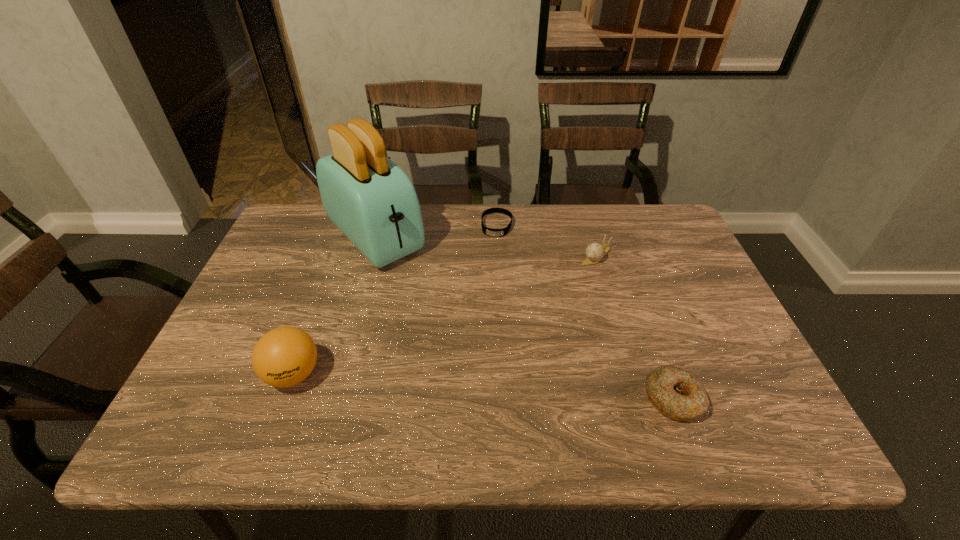
Locate an element on the screen. vacant space that's between the second tallest object and the tallest object is located at coordinates (334, 306).

The width and height of the screenshot is (960, 540). Identify the location of vacant point located between the escargot and the ping-pong ball. (444, 315).

Image resolution: width=960 pixels, height=540 pixels. Identify the location of object that stands as the closest to the wristband. (372, 201).

The height and width of the screenshot is (540, 960). In order to click on object that ranks as the fourth closest to the second tallest object in this screenshot , I will do `click(595, 251)`.

Identify the location of vacant space that satisfies the following two spatial constraints: 1. on the side with brand of the doughnut; 2. on the right side of the fourth shortest object. (284, 399).

Locate an element on the screen. The image size is (960, 540). vacant space that satisfies the following two spatial constraints: 1. on the side with brand of the doughnut; 2. on the left side of the ping-pong ball is located at coordinates (284, 399).